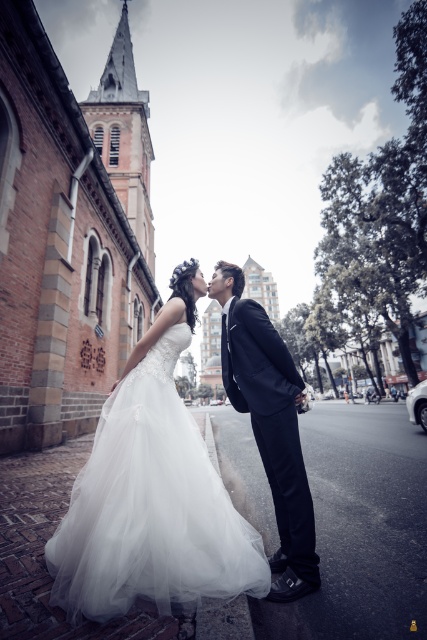
Between white tulle dress at center and shiny black suit at center, which one appears on the right side from the viewer's perspective?

Positioned to the right is shiny black suit at center.

Is white tulle dress at center wider than shiny black suit at center?

Yes.

Image resolution: width=427 pixels, height=640 pixels. I want to click on white tulle dress at center, so click(x=151, y=508).

Where is `white tulle dress at center`? white tulle dress at center is located at coordinates (151, 508).